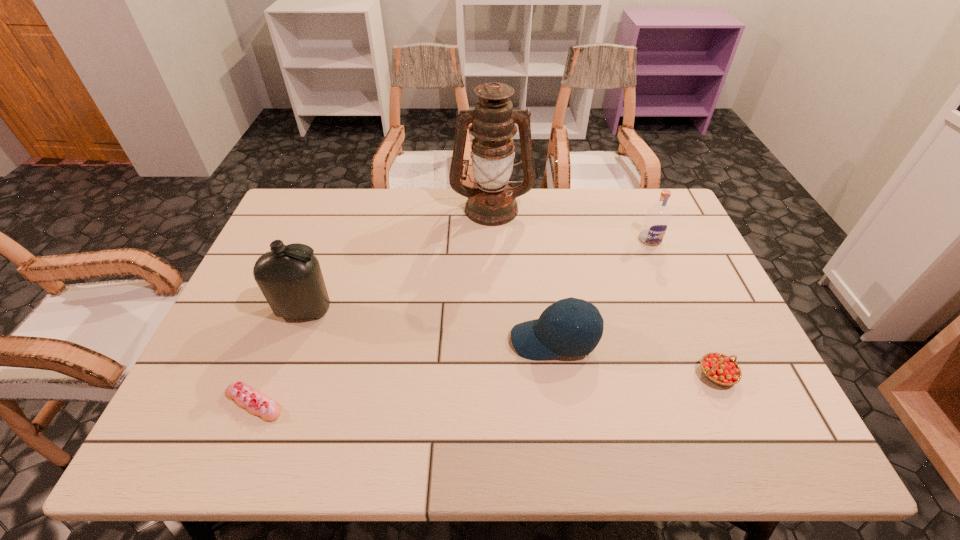
Identify the location of the tallest object. The width and height of the screenshot is (960, 540). (491, 202).

Identify the location of lantern. (491, 202).

Where is `bottle`? This screenshot has width=960, height=540. bottle is located at coordinates (289, 276).

Locate an element on the screen. The image size is (960, 540). the third tallest object is located at coordinates (656, 221).

Image resolution: width=960 pixels, height=540 pixels. Find the location of `the second farthest object`. the second farthest object is located at coordinates (656, 221).

Locate an element on the screen. baseball cap is located at coordinates (555, 333).

Find the location of a particular element. The image size is (960, 540). the fifth tallest object is located at coordinates (720, 369).

The height and width of the screenshot is (540, 960). In order to click on the shortest object in this screenshot , I will do `click(247, 397)`.

Locate an element on the screen. vacant space located 0.100m on the left of the farthest object is located at coordinates (420, 208).

At what (x,y) coordinates should I click in order to perform the action: click on blank space located on the left of the bottle. Please return your answer as a coordinate pair (x, y). This screenshot has height=540, width=960. Looking at the image, I should click on (233, 311).